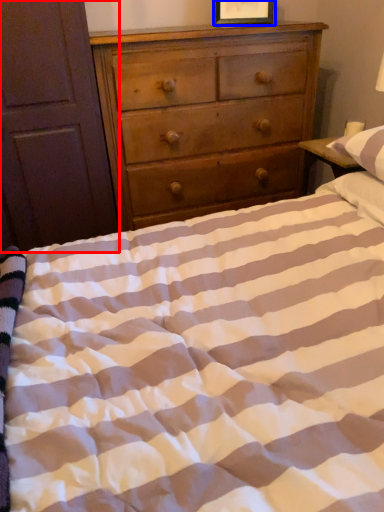
Question: Which object is closer to the camera taking this photo, armoire (highlighted by a red box) or picture frame (highlighted by a blue box)?

Choices:
 (A) armoire
 (B) picture frame

Answer: (A)